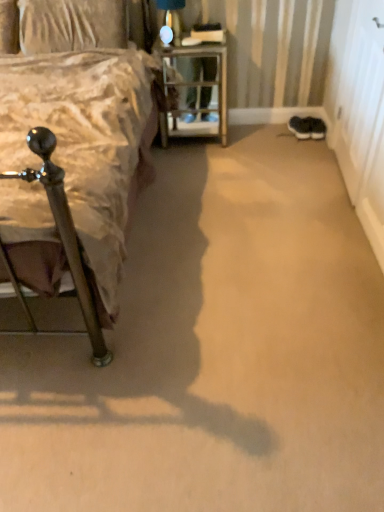
At what (x,y) coordinates should I click in order to perform the action: click on free spot behind white wood screen door at right. Please return your answer as a coordinate pair (x, y). Image resolution: width=384 pixels, height=512 pixels. Looking at the image, I should click on (299, 142).